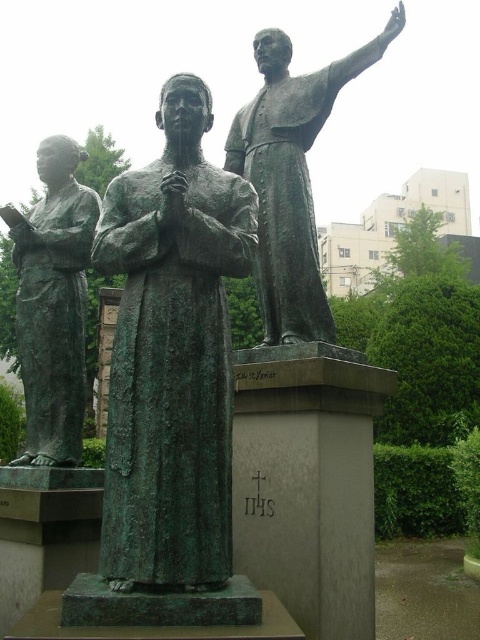
Question: Among these objects, which one is farthest from the camera?

Choices:
 (A) green patina statue at left
 (B) green patina bronze statue at center

Answer: (A)

Question: Considering the real-world distances, which object is closest to the green patina statue at left?

Choices:
 (A) green patina bronze statue at center
 (B) bronze statue at upper right

Answer: (B)

Question: Is green patina bronze statue at center positioned before bronze statue at upper right?

Choices:
 (A) no
 (B) yes

Answer: (B)

Question: Does bronze statue at upper right have a lesser width compared to green patina statue at left?

Choices:
 (A) no
 (B) yes

Answer: (B)

Question: Among these points, which one is farthest from the camera?

Choices:
 (A) click(280, 225)
 (B) click(82, 205)

Answer: (B)

Question: Observing the image, what is the correct spatial positioning of green patina bronze statue at center in reference to bronze statue at upper right?

Choices:
 (A) left
 (B) right

Answer: (A)